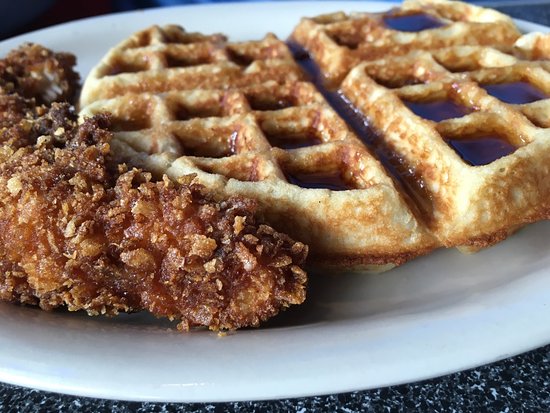
Identify the location of plate. The height and width of the screenshot is (413, 550). (411, 306).